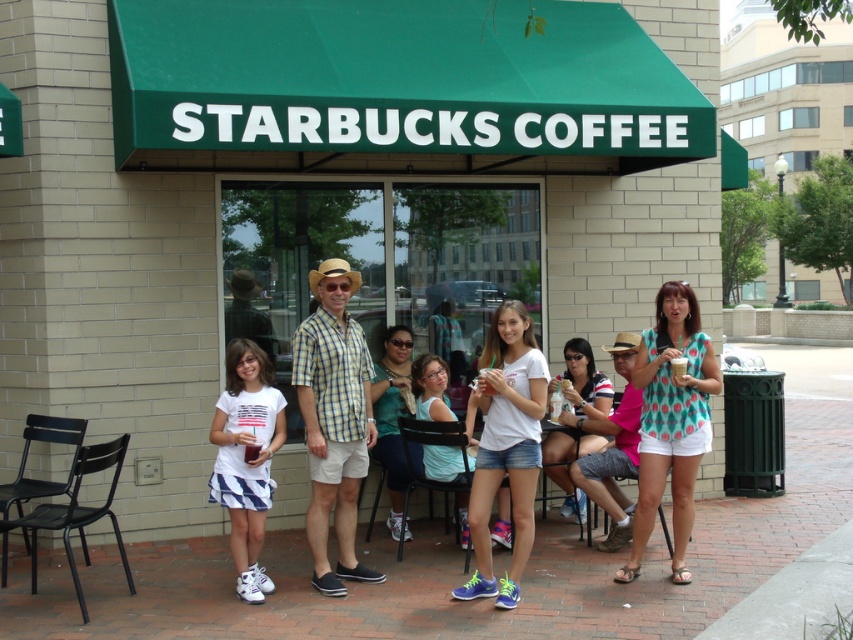
Is point (355, 401) farther from camera compared to point (392, 380)?

No, (355, 401) is closer to viewer.

Does yellow plaid shirt at center have a greater width compared to teal fabric shirt at center?

Yes.

Where is `yellow plaid shirt at center`? yellow plaid shirt at center is located at coordinates (334, 420).

Does polka dot blouse at center have a larger size compared to white matte t-shirt at center?

Yes.

Is polka dot blouse at center behind white matte t-shirt at center?

Yes, it is behind white matte t-shirt at center.

Where is `polka dot blouse at center`? The width and height of the screenshot is (853, 640). polka dot blouse at center is located at coordinates (671, 420).

Measure the distance between polka dot blouse at center and white cotton t-shirt at center.

polka dot blouse at center is 7.53 feet from white cotton t-shirt at center.

From the picture: Is polka dot blouse at center to the right of white cotton t-shirt at center from the viewer's perspective?

Yes, polka dot blouse at center is to the right of white cotton t-shirt at center.

You are a GUI agent. You are given a task and a screenshot of the screen. Output one action in this format:
    pyautogui.click(x=<x>, y=<y>)
    Task: Click on the polka dot blouse at center
    
    Given the screenshot: What is the action you would take?
    pyautogui.click(x=671, y=420)

The width and height of the screenshot is (853, 640). I want to click on polka dot blouse at center, so click(671, 420).